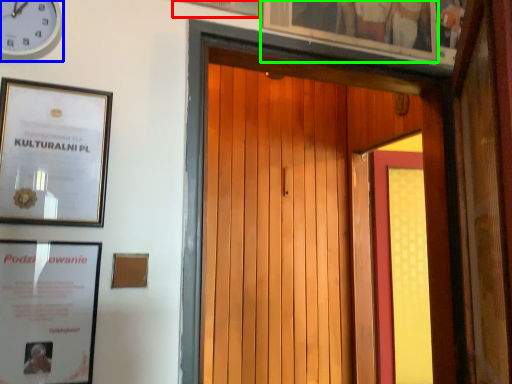
Question: Based on their relative distances, which object is nearer to picture frame (highlighted by a red box)? Choose from clock (highlighted by a blue box) and picture frame (highlighted by a green box).

Choices:
 (A) clock
 (B) picture frame

Answer: (B)